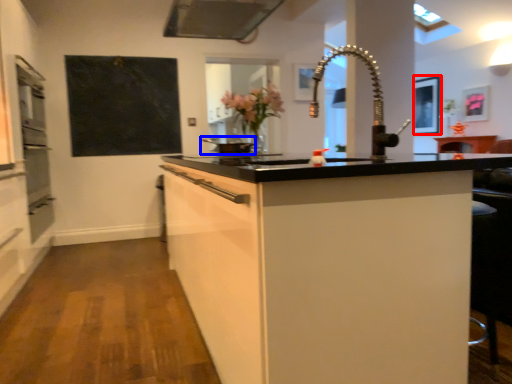
Question: Which object appears closest to the camera in this image, picture frame (highlighted by a red box) or appliance (highlighted by a blue box)?

Choices:
 (A) picture frame
 (B) appliance

Answer: (B)